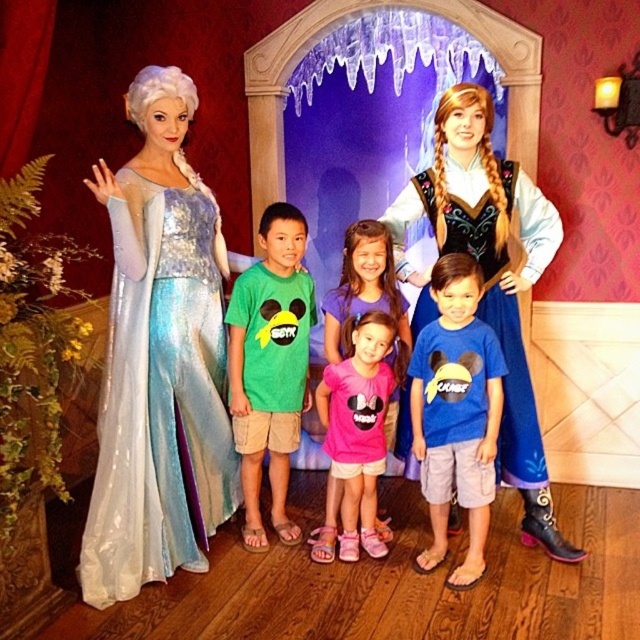
Who is more forward, (160, 232) or (273, 476)?

Point (160, 232) is more forward.

Is point (156, 196) less distant than point (246, 394)?

That is True.

Between point (150, 540) and point (291, 433), which one is positioned behind?

The point (291, 433) is behind.

The height and width of the screenshot is (640, 640). What are the coordinates of `matte silver gown at left` in the screenshot? It's located at (154, 358).

Is satin shimmering gown at left bigger than blue cotton shirt at center?

Yes, satin shimmering gown at left is bigger than blue cotton shirt at center.

Does satin shimmering gown at left appear on the right side of blue cotton shirt at center?

Incorrect, satin shimmering gown at left is not on the right side of blue cotton shirt at center.

Between point (224, 328) and point (426, 429), which one is positioned behind?

Point (224, 328)

This screenshot has width=640, height=640. In order to click on satin shimmering gown at left in this screenshot , I will do coord(160,396).

Who is higher up, green fabric shirt at center or pink fabric shirt at center?

green fabric shirt at center

Between green fabric shirt at center and pink fabric shirt at center, which one has less height?

Standing shorter between the two is pink fabric shirt at center.

Locate an element on the screen. Image resolution: width=640 pixels, height=640 pixels. green fabric shirt at center is located at coordinates (269, 365).